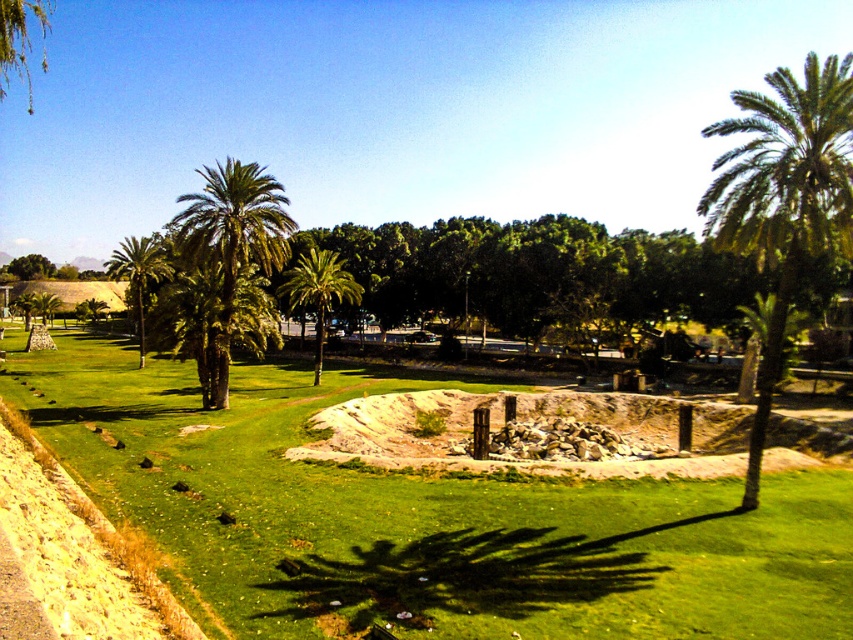
Question: Among these points, which one is farthest from the camera?

Choices:
 (A) (329, 292)
 (B) (260, 205)
 (C) (730, 176)

Answer: (A)

Question: Can you confirm if green leafy palm tree at right is positioned below green leafy palm tree at center-left?

Choices:
 (A) yes
 (B) no

Answer: (B)

Question: Which object is the closest to the green leafy palm tree at center-left?

Choices:
 (A) green leafy palm tree at left
 (B) green leafy palm tree at right
 (C) green leafy palm tree at center

Answer: (C)

Question: Is green leafy palm tree at right thinner than green leafy palm tree at left?

Choices:
 (A) yes
 (B) no

Answer: (B)

Question: Is green leafy palm tree at right further to the viewer compared to green leafy palm tree at center?

Choices:
 (A) yes
 (B) no

Answer: (B)

Question: Which of the following is the farthest from the observer?

Choices:
 (A) (750, 508)
 (B) (140, 262)
 (C) (202, 228)
 (D) (291, 307)

Answer: (D)